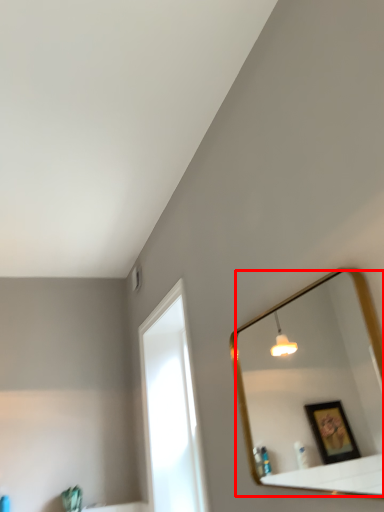
Question: In this image, where is mirror (annotated by the red box) located relative to window?

Choices:
 (A) right
 (B) left

Answer: (A)